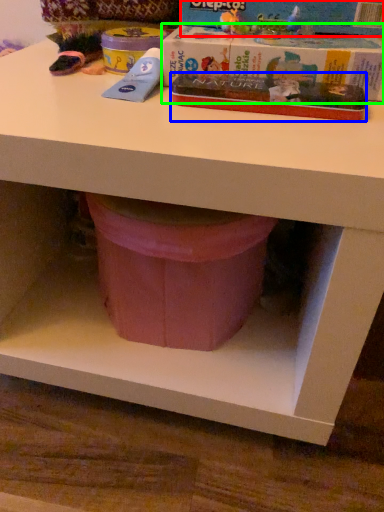
Question: Based on their relative distances, which object is nearer to paperback book (highlighted by a red box)? Choose from paperback book (highlighted by a blue box) and paperback book (highlighted by a green box).

Choices:
 (A) paperback book
 (B) paperback book

Answer: (B)